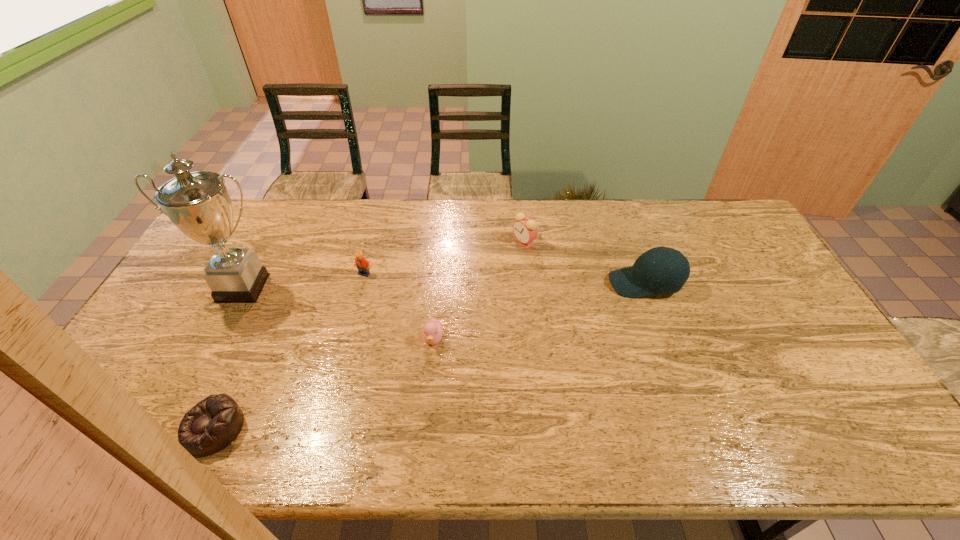
Find the location of a particular element. The height and width of the screenshot is (540, 960). object positioned at the near edge is located at coordinates (214, 423).

At what (x,y) coordinates should I click in order to perform the action: click on object located at the left edge. Please return your answer as a coordinate pair (x, y). Looking at the image, I should click on (197, 203).

Image resolution: width=960 pixels, height=540 pixels. What are the coordinates of `vacant space at the far edge of the desktop` in the screenshot? It's located at (611, 199).

In the image, there is a desktop. At what (x,y) coordinates should I click in order to perform the action: click on vacant space at the near edge. Please return your answer as a coordinate pair (x, y). Looking at the image, I should click on (413, 427).

I want to click on vacant space at the left edge of the desktop, so click(180, 316).

In the image, there is a desktop. Identify the location of vacant space at the far right corner. (716, 208).

Locate an element on the screen. This screenshot has height=540, width=960. free space between the Lego and the second tallest object is located at coordinates (505, 279).

Where is `vacant space that's between the fifth object from left to right and the third object from right to left`? vacant space that's between the fifth object from left to right and the third object from right to left is located at coordinates (479, 291).

Where is `free space between the tallest object and the fifth object from left to right`? Image resolution: width=960 pixels, height=540 pixels. free space between the tallest object and the fifth object from left to right is located at coordinates 383,265.

In order to click on free area in between the baseball cap and the Lego in this screenshot , I will do `click(505, 279)`.